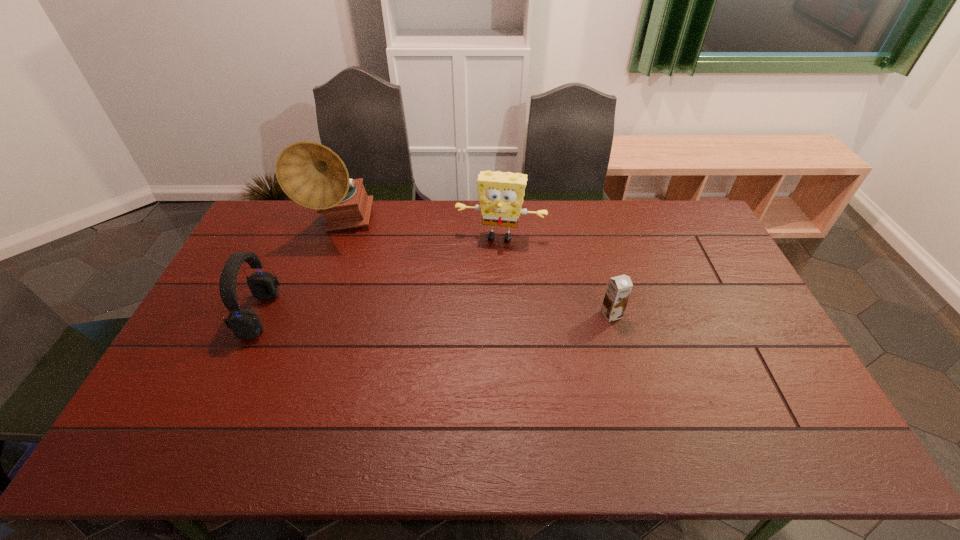
Locate an element on the screen. free space on the desktop that is between the headset and the shortest object and is positioned on the horn of the phonograph record is located at coordinates (397, 314).

The image size is (960, 540). In order to click on free space on the desktop that is between the headset and the chocolate milk and is positioned on the face of the second object from right to left in this screenshot , I will do `click(488, 314)`.